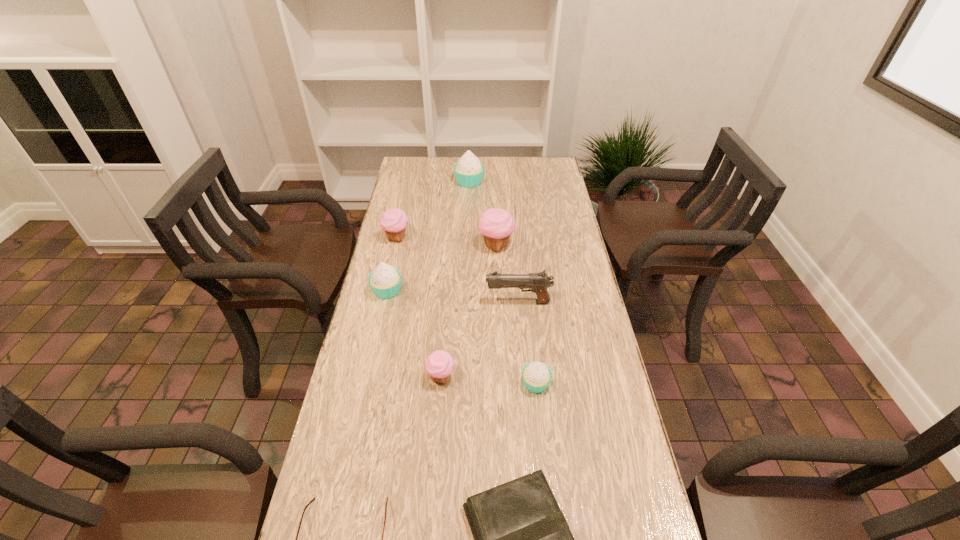
What are the coordinates of `white cupcake that stands as the second closest to the nearest white cupcake` in the screenshot? It's located at (469, 171).

Locate an element on the screen. This screenshot has height=540, width=960. vacant space that satisfies the following two spatial constraints: 1. on the back side of the second biggest white cupcake; 2. on the right side of the farthest cupcake is located at coordinates [411, 182].